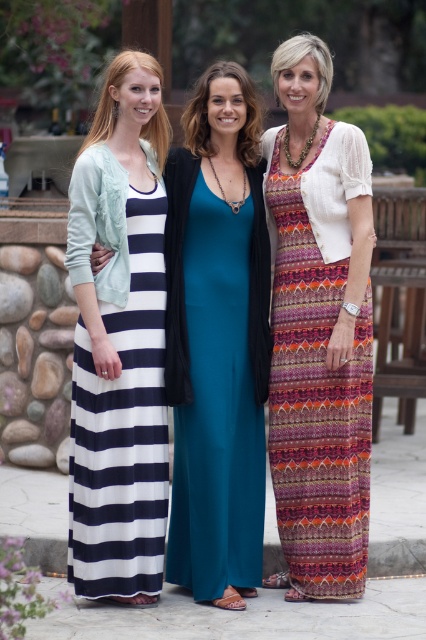
You are standing in the garden and want to move from the point at coordinates point [178,362] to the point at coordinates point [80,177]. Since you can only move forward, will you be moving towards or away from the wooden structure behind the women?

Point [178,362] is further to the viewer than point [80,177]. Therefore, moving from point [178,362] to point [80,177] means you are moving away from the wooden structure behind the women.

You are taking a photo of the two women in the scene. The teal satin dress at center and the multicolored woven dress at right are both in frame. Based on their positions, which dress will appear larger in your photo?

The teal satin dress at center appears larger in the photo because it is closer to the viewer than the multicolored woven dress at right.

You are standing in a garden where three women are posing. You notice a point marked at coordinates (215, 378). Which woman is closest to this point?

The point at (215, 378) marks the teal satin dress at center, so the woman in the center is closest to this point.